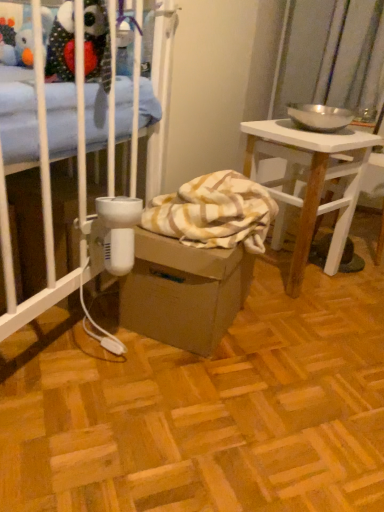
You are a GUI agent. You are given a task and a screenshot of the screen. Output one action in this format:
    pyautogui.click(x=<x>, y=<y>)
    Task: Click on the vacant space underneath white wood desk at right (from a real-world perspective)
    This screenshot has width=384, height=512.
    Given the screenshot: What is the action you would take?
    pyautogui.click(x=302, y=273)